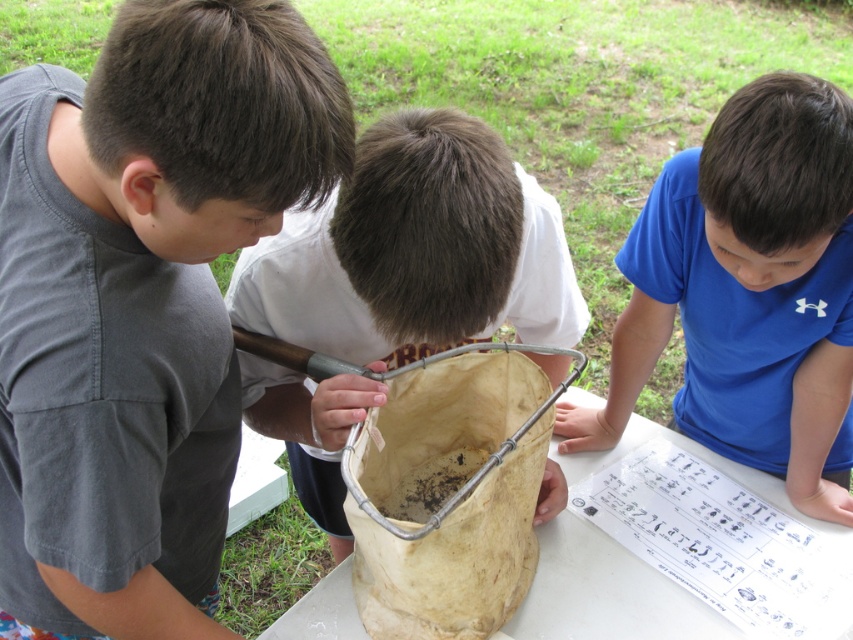
You are a teacher observing the children around the table. You need to place a small plant in a pot that is 10 cm tall. Which object on the table, the blue cotton shirt at upper right or the light brown paper bag at center, should you place the pot on to ensure it is visible to all children?

The light brown paper bag at center is taller than the blue cotton shirt at upper right. Placing the pot on the light brown paper bag at center will make it more visible to the children.

Looking at this image, you are a photographer trying to capture a clear shot of both the blue cotton shirt at upper right and the light brown paper bag at center. Which object should you focus on first to ensure both are in focus?

You should focus on the blue cotton shirt at upper right first because it is closer to you than the light brown paper bag at center. By focusing on the closer object, the farther one may still be in the depth of field.